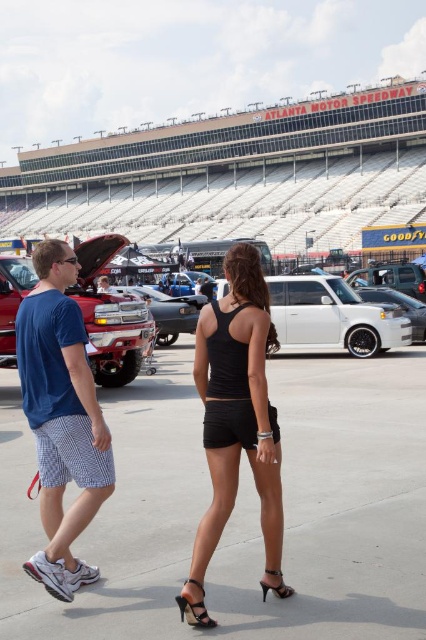
Question: Which is farther from the shiny chrome truck at center?

Choices:
 (A) white matte suv at center
 (B) black patent leather high heels at lower center
 (C) shiny chrome truck at left

Answer: (B)

Question: Estimate the real-world distances between objects in this image. Which object is farther from the black fabric race track at center?

Choices:
 (A) white matte suv at center
 (B) shiny chrome truck at center
 (C) shiny chrome truck at left
 (D) black patent leather high heels at lower center

Answer: (B)

Question: Is white matte suv at center positioned before black patent leather high heels at lower center?

Choices:
 (A) yes
 (B) no

Answer: (B)

Question: Can you confirm if black matte tank top at center is positioned to the right of black leather high-heeled sandal at lower center?

Choices:
 (A) yes
 (B) no

Answer: (A)

Question: Is shiny chrome truck at center thinner than black patent leather high heels at lower center?

Choices:
 (A) yes
 (B) no

Answer: (B)

Question: Among these points, which one is farthest from the camera?

Choices:
 (A) (80, 349)
 (B) (382, 387)

Answer: (B)